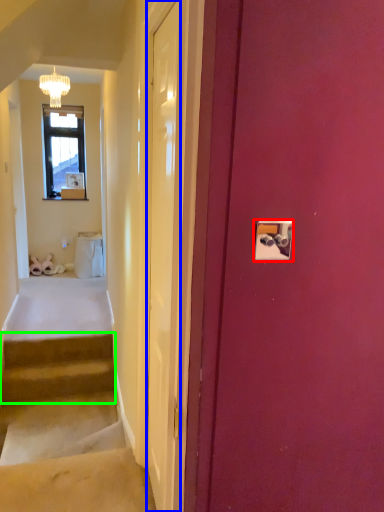
Question: Which is farther away from light switch (highlighted by a red box)? door (highlighted by a blue box) or stairs (highlighted by a green box)?

Choices:
 (A) door
 (B) stairs

Answer: (B)